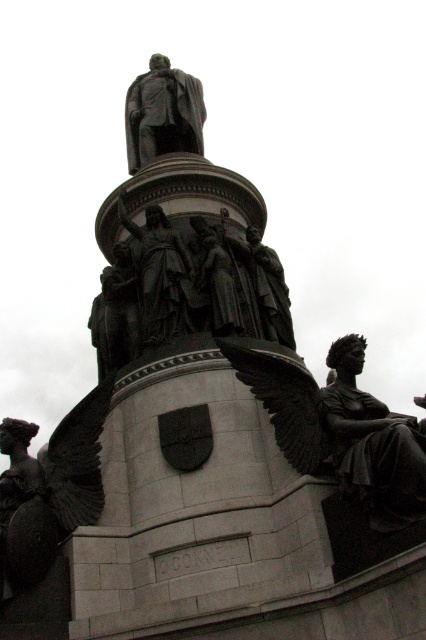
Does polished bronze statue at right appear over bronze statue at center?

Actually, polished bronze statue at right is below bronze statue at center.

Consider the image. Does polished bronze statue at right have a greater height compared to bronze statue at center?

Incorrect, polished bronze statue at right's height is not larger of bronze statue at center's.

Locate an element on the screen. polished bronze statue at right is located at coordinates (373, 444).

Identify the location of polished bronze statue at right. Image resolution: width=426 pixels, height=640 pixels. (373, 444).